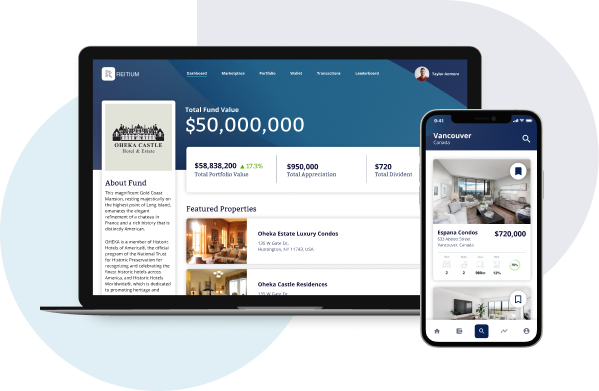
The image size is (599, 391). In order to click on black edge around laptop screen in this screenshot , I will do `click(84, 131)`.